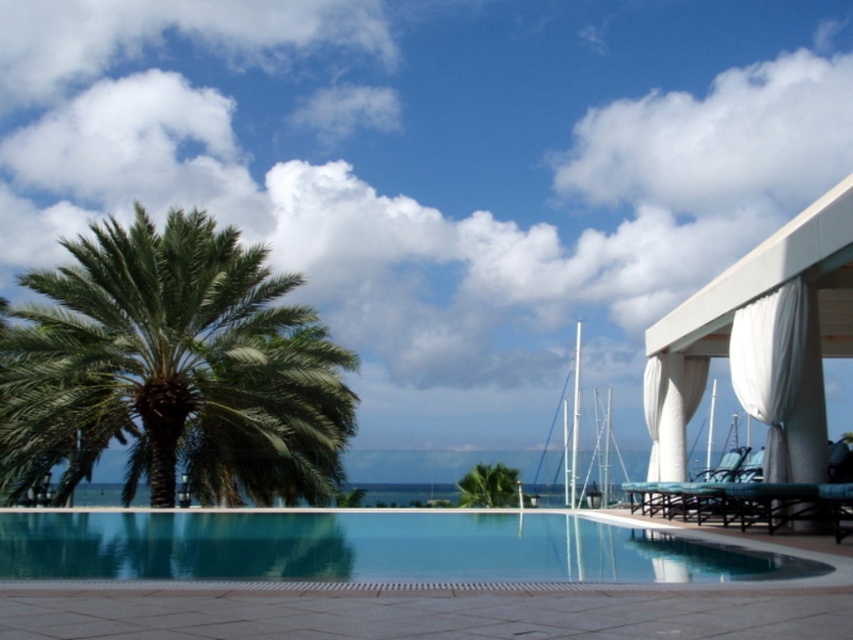
Question: Among these points, which one is farthest from the camera?

Choices:
 (A) (569, 490)
 (B) (256, 244)
 (C) (222, 552)

Answer: (A)

Question: In this image, where is green leafy palm tree at left located relative to clear glass pool at center?

Choices:
 (A) right
 (B) left

Answer: (B)

Question: Is clear glass pool at center wider than white glossy masts at upper center?

Choices:
 (A) no
 (B) yes

Answer: (B)

Question: Which is farther from the white glossy masts at upper center?

Choices:
 (A) clear glass pool at center
 (B) green leafy palm tree at left

Answer: (A)

Question: Among these points, which one is farthest from the camera?

Choices:
 (A) (238, 564)
 (B) (601, 424)

Answer: (B)

Question: Observing the image, what is the correct spatial positioning of green leafy palm tree at left in reference to white glossy masts at upper center?

Choices:
 (A) below
 (B) above

Answer: (B)